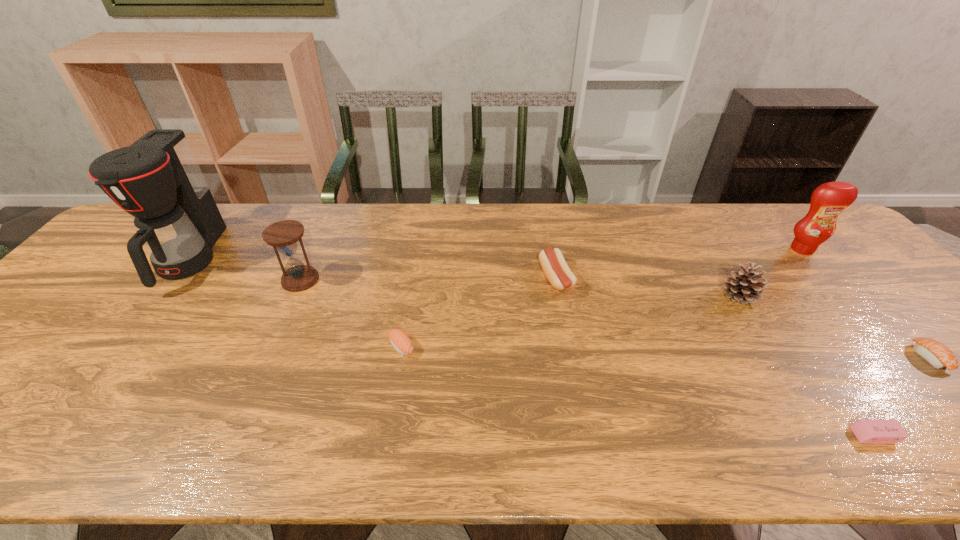
The height and width of the screenshot is (540, 960). In order to click on the leftmost object in this screenshot , I will do `click(157, 179)`.

Identify the location of coffee maker. click(157, 179).

The width and height of the screenshot is (960, 540). Identify the location of condiment. (828, 200).

Identify the location of the sixth shortest object. (297, 277).

Locate an element on the screen. This screenshot has height=540, width=960. hourglass is located at coordinates (297, 277).

I want to click on pinecone, so click(x=747, y=287).

Where is `the fourth tallest object`? This screenshot has width=960, height=540. the fourth tallest object is located at coordinates (747, 287).

Locate an element on the screen. This screenshot has width=960, height=540. the fifth object from right to left is located at coordinates (556, 270).

Locate an element on the screen. The width and height of the screenshot is (960, 540). sausage is located at coordinates (556, 270).

Identify the location of the left sushi. (400, 341).